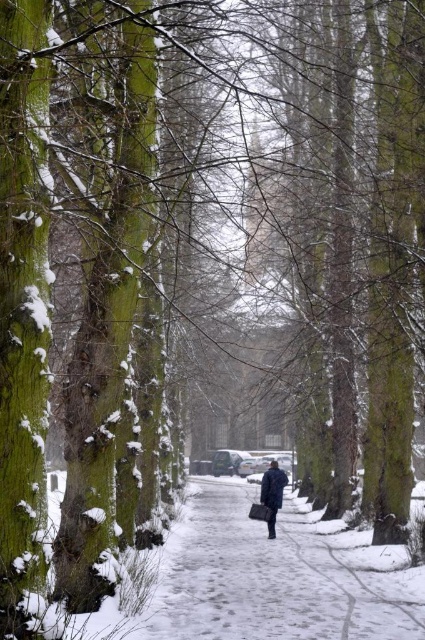
Question: Is white snow-covered pavement at center above dark blue coat at center?

Choices:
 (A) yes
 (B) no

Answer: (B)

Question: Can you confirm if white snow-covered pavement at center is thinner than dark blue coat at center?

Choices:
 (A) yes
 (B) no

Answer: (B)

Question: Which point is farther from the camera taking this photo?

Choices:
 (A) (158, 618)
 (B) (266, 492)

Answer: (B)

Question: Observing the image, what is the correct spatial positioning of white snow-covered pavement at center in reference to dark blue coat at center?

Choices:
 (A) below
 (B) above

Answer: (A)

Question: Which of the following is the closest to the observer?

Choices:
 (A) white snow-covered pavement at center
 (B) dark blue coat at center

Answer: (A)